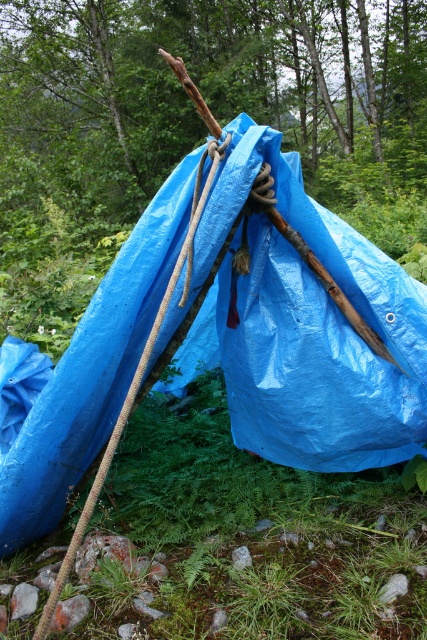
Is blue tarpaulin at center smaller than roperoughrope at left?

No.

Is point (412, 307) behind point (99, 486)?

Yes.

Which is in front, point (310, 410) or point (181, 253)?

Positioned in front is point (181, 253).

The image size is (427, 640). I want to click on blue tarpaulin at center, so click(x=300, y=323).

Can you confirm if blue tarpaulin tent at center is smaller than roperoughrope at left?

Actually, blue tarpaulin tent at center might be larger than roperoughrope at left.

Can you confirm if blue tarpaulin tent at center is thinner than roperoughrope at left?

Incorrect, blue tarpaulin tent at center's width is not less than roperoughrope at left's.

You are a GUI agent. You are given a task and a screenshot of the screen. Output one action in this format:
    pyautogui.click(x=<x>, y=<y>)
    Task: Click on the blue tarpaulin tent at center
    Image resolution: width=427 pixels, height=640 pixels.
    Given the screenshot: What is the action you would take?
    204,88

Does blue tarpaulin at center appear under blue tarpaulin tent at center?

Yes, blue tarpaulin at center is below blue tarpaulin tent at center.

Is blue tarpaulin at center positioned in front of blue tarpaulin tent at center?

Yes.

Which is in front, point (248, 256) or point (105, 120)?

Positioned in front is point (248, 256).

Find the location of `blue tarpaulin at center`. blue tarpaulin at center is located at coordinates (300, 323).